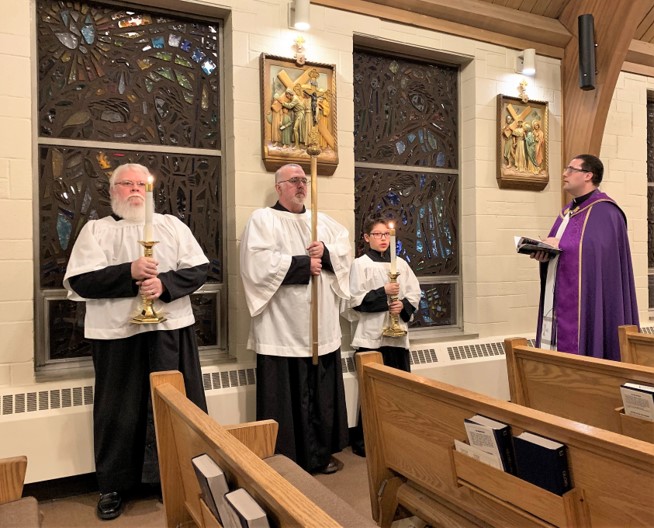
Locate an element on the screen. This screenshot has height=528, width=654. window is located at coordinates (69, 326), (67, 208), (90, 110), (405, 103), (422, 218), (436, 299).